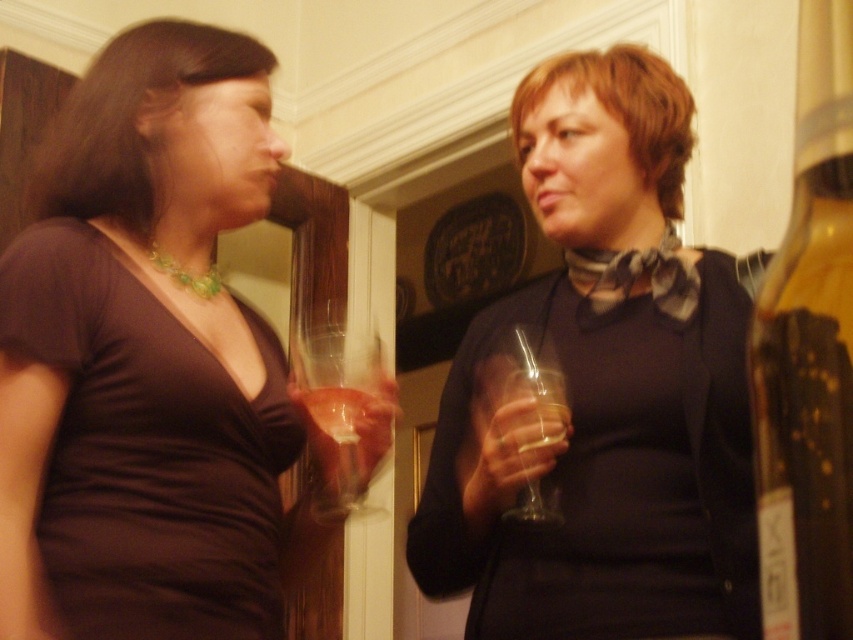
Question: Is transparent glass at center above transparent glass wine glass at right?

Choices:
 (A) no
 (B) yes

Answer: (A)

Question: Can you confirm if transparent glass at center is wider than transparent glass wine glass at right?

Choices:
 (A) no
 (B) yes

Answer: (B)

Question: Does matte black dress at center appear on the left side of transparent glass at center?

Choices:
 (A) yes
 (B) no

Answer: (B)

Question: Which object is positioned closest to the matte brown blouse at left?

Choices:
 (A) translucent glass bottle at right
 (B) matte black dress at center

Answer: (B)

Question: Which of these objects is positioned farthest from the matte black dress at center?

Choices:
 (A) matte brown blouse at left
 (B) transparent glass at center
 (C) transparent glass wine glass at right
 (D) translucent glass bottle at right

Answer: (D)

Question: Which is nearer to the translucent glass bottle at right?

Choices:
 (A) transparent glass wine glass at right
 (B) matte brown blouse at left
 (C) matte black dress at center
 (D) transparent glass at center

Answer: (A)